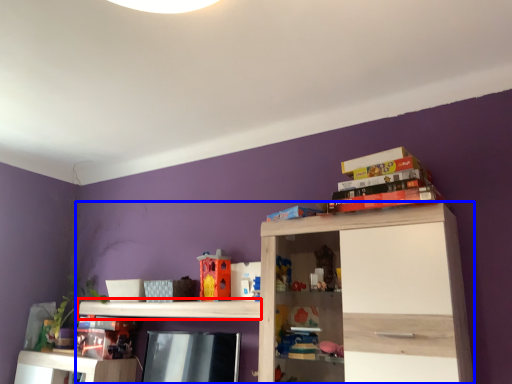
Question: Among these objects, which one is farthest to the camera, shelf (highlighted by a red box) or shelf (highlighted by a blue box)?

Choices:
 (A) shelf
 (B) shelf

Answer: (A)